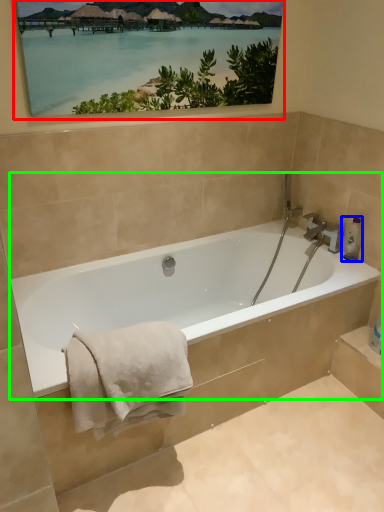
Question: Which object is positioned closest to picture frame (highlighted by a red box)? Select from toiletry (highlighted by a blue box) and bathtub (highlighted by a green box).

Choices:
 (A) toiletry
 (B) bathtub

Answer: (B)